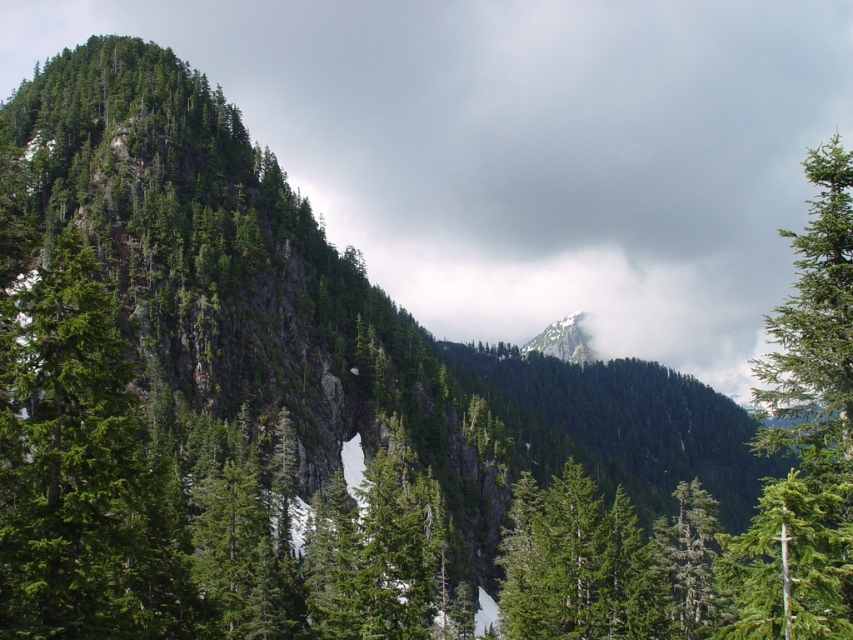
Which of these two, green matte tree at right or white snow-covered mountain at center, stands taller?

green matte tree at right is taller.

Which of these two, green matte tree at right or white snow-covered mountain at center, stands shorter?

white snow-covered mountain at center

Which is in front, point (828, 397) or point (581, 360)?

Point (828, 397)

Locate an element on the screen. This screenshot has width=853, height=640. green matte tree at right is located at coordinates (805, 433).

Does white fluffy cloud at upper center have a smaller size compared to green matte tree at right?

No.

Who is more forward, (695,310) or (795,568)?

Point (795,568)

Where is `white fluffy cloud at upper center`? The width and height of the screenshot is (853, 640). white fluffy cloud at upper center is located at coordinates (527, 148).

Which is more to the right, green matte tree at right or green matte tree at center?

green matte tree at right

Is green matte tree at right above green matte tree at center?

Yes, green matte tree at right is above green matte tree at center.

Is point (830, 392) positioned before point (689, 582)?

Yes, it is.

This screenshot has height=640, width=853. Find the location of `green matte tree at right`. green matte tree at right is located at coordinates point(805,433).